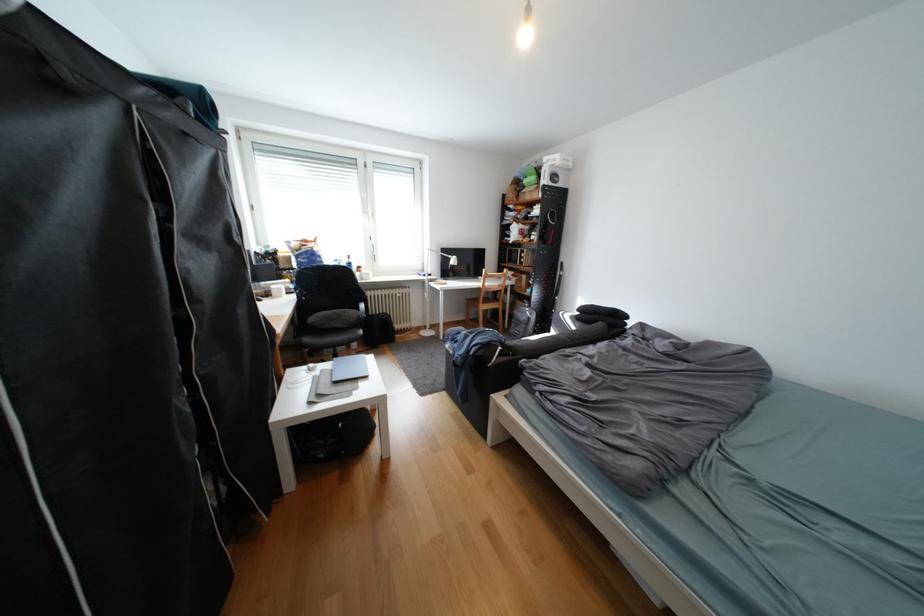
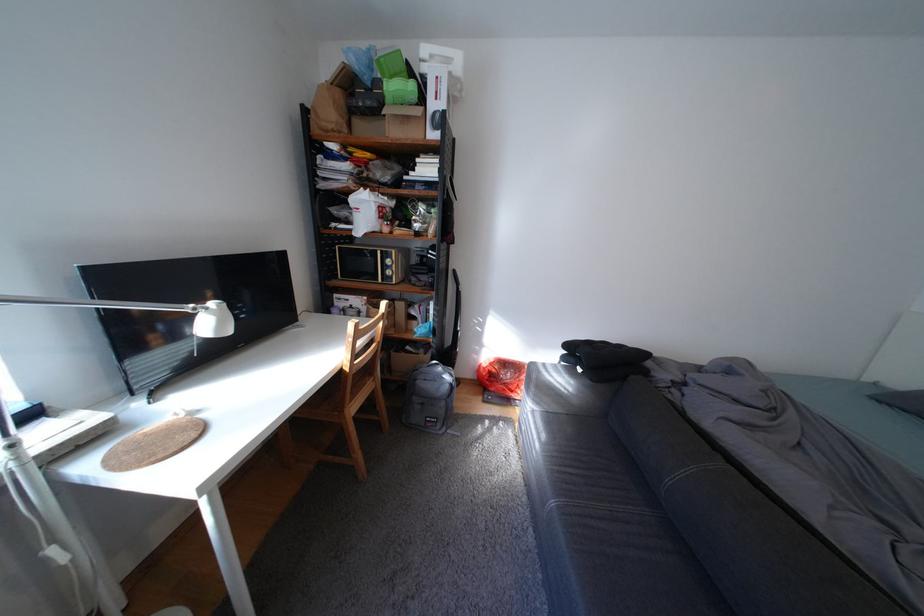
The point at (x=467, y=257) is marked in the first image. Where is the corresponding point in the second image?

(225, 305)